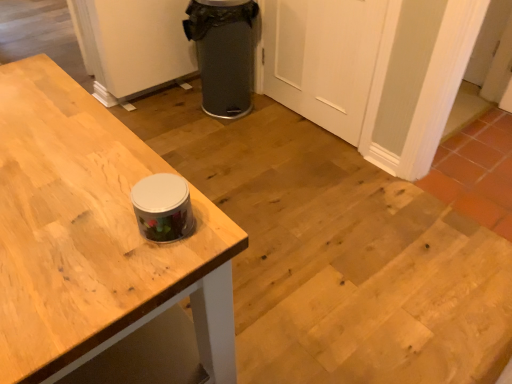
Where is `wooden table at upper left`? The width and height of the screenshot is (512, 384). wooden table at upper left is located at coordinates (91, 231).

What do you see at coordinates (91, 231) in the screenshot? This screenshot has height=384, width=512. I see `wooden table at upper left` at bounding box center [91, 231].

Locate an element on the screen. The width and height of the screenshot is (512, 384). wooden table at upper left is located at coordinates (91, 231).